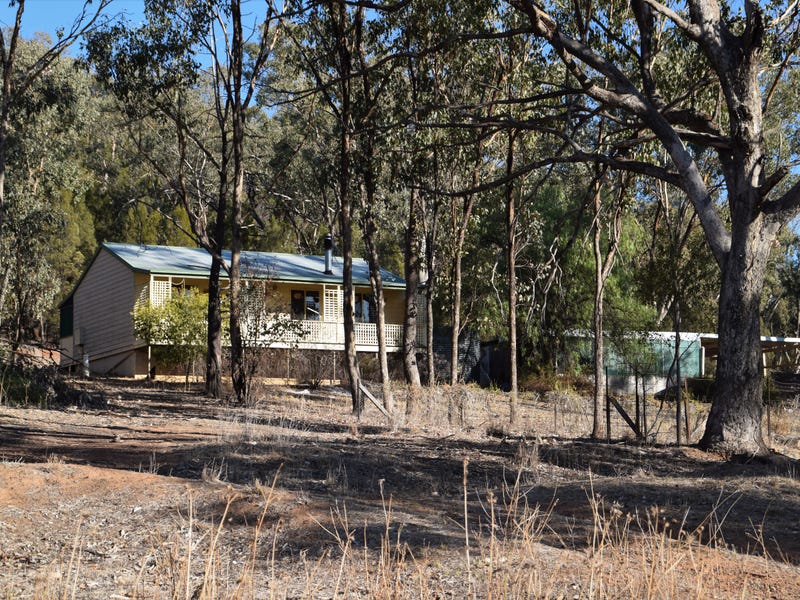
Where is `window`? The height and width of the screenshot is (600, 800). window is located at coordinates (369, 304).